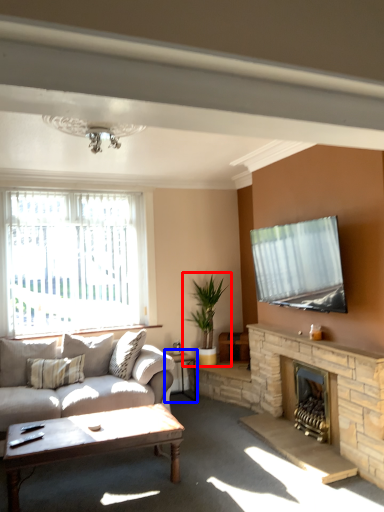
Question: Which object is closer to the camera taking this photo, houseplant (highlighted by a red box) or table (highlighted by a blue box)?

Choices:
 (A) houseplant
 (B) table

Answer: (B)